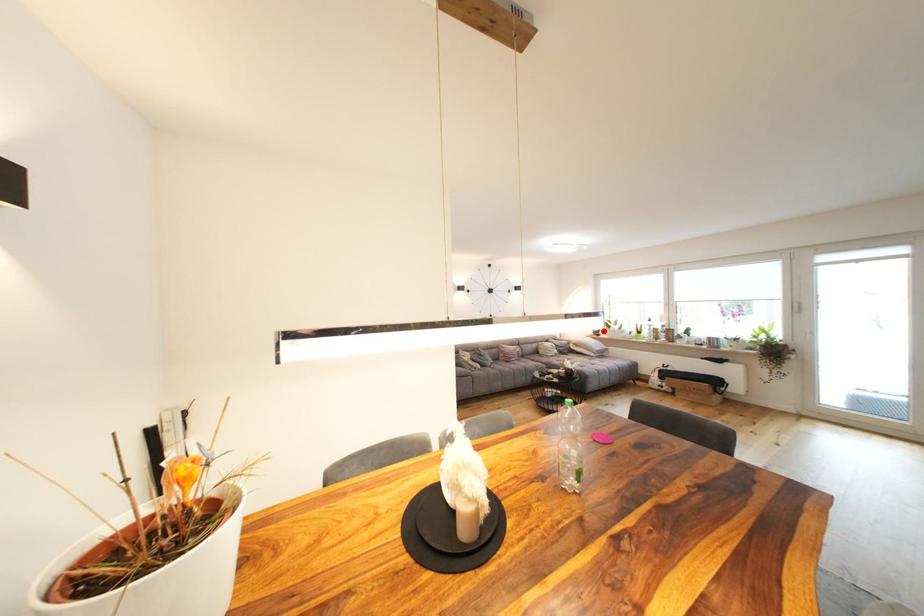
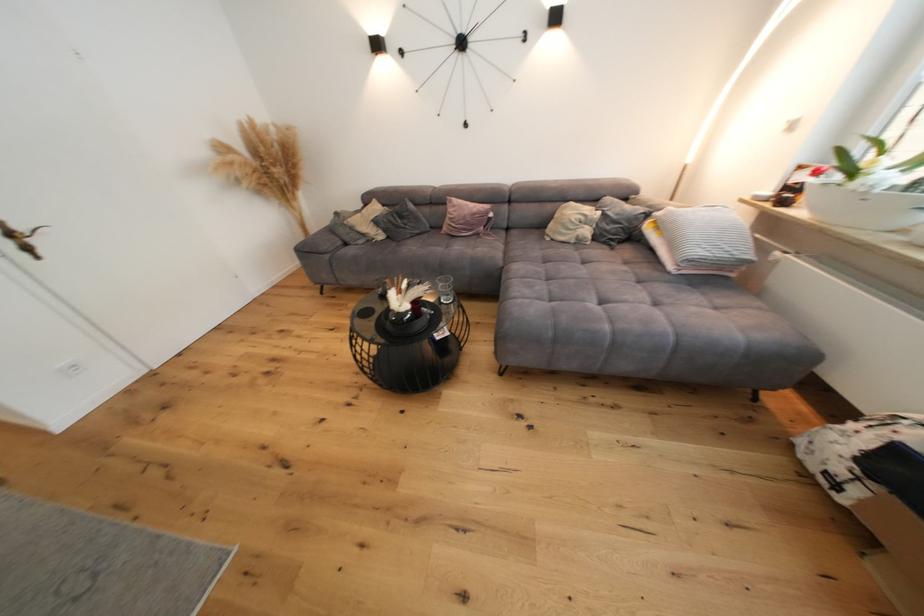
In the second image, find the point that corresponds to the highlighted location in the first image.

(809, 179)